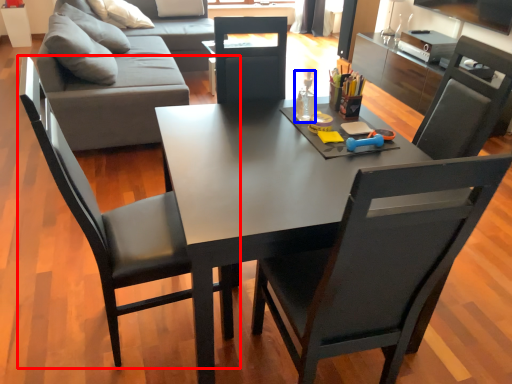
Question: Which object is further to the camera taking this photo, chair (highlighted by a red box) or bottle (highlighted by a blue box)?

Choices:
 (A) chair
 (B) bottle

Answer: (B)